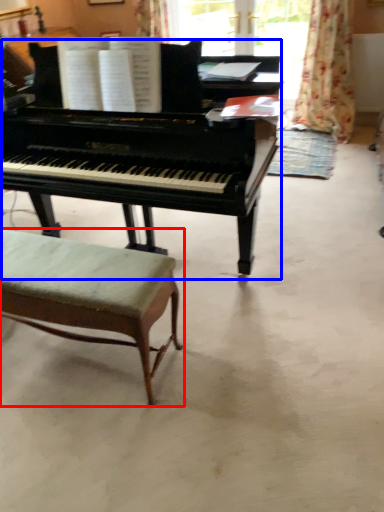
Question: Which of the following is the closest to the observer, stool (highlighted by a red box) or piano (highlighted by a blue box)?

Choices:
 (A) stool
 (B) piano

Answer: (B)